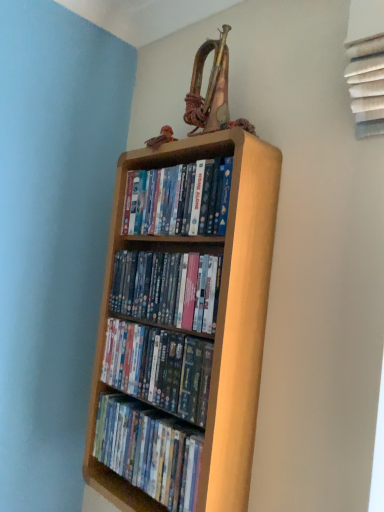
Question: Considering the relative sizes of light wood bookcase at center and matte plastic dvds at center, positioned as the third book in top-to-bottom order, in the image provided, is light wood bookcase at center thinner than matte plastic dvds at center, positioned as the third book in top-to-bottom order,?

Choices:
 (A) yes
 (B) no

Answer: (A)

Question: From a real-world perspective, is light wood bookcase at center on matte plastic dvds at center, positioned as the third book in top-to-bottom order?

Choices:
 (A) yes
 (B) no

Answer: (A)

Question: Can you confirm if light wood bookcase at center is wider than matte plastic dvds at center, acting as the second book starting from the bottom?

Choices:
 (A) yes
 (B) no

Answer: (B)

Question: Can you confirm if light wood bookcase at center is positioned to the right of matte plastic dvds at center, positioned as the third book in top-to-bottom order?

Choices:
 (A) yes
 (B) no

Answer: (A)

Question: Is light wood bookcase at center oriented towards matte plastic dvds at center, acting as the second book starting from the bottom?

Choices:
 (A) yes
 (B) no

Answer: (A)

Question: Is wooden shelf at center, the 3th book positioned from the bottom, taller or shorter than wooden shelf at center, the 4th book in the top-to-bottom sequence?

Choices:
 (A) short
 (B) tall

Answer: (A)

Question: Considering the positions of point (170, 257) and point (195, 501), is point (170, 257) closer or farther from the camera than point (195, 501)?

Choices:
 (A) closer
 (B) farther

Answer: (B)

Question: Considering the positions of wooden shelf at center, the 3th book positioned from the bottom, and wooden shelf at center, the 4th book in the top-to-bottom sequence, in the image, is wooden shelf at center, the 3th book positioned from the bottom, bigger or smaller than wooden shelf at center, the 4th book in the top-to-bottom sequence,?

Choices:
 (A) big
 (B) small

Answer: (B)

Question: Is wooden shelf at center, the 3th book positioned from the bottom, wider or thinner than wooden shelf at center, the 4th book in the top-to-bottom sequence?

Choices:
 (A) wide
 (B) thin

Answer: (B)

Question: From the image's perspective, is matte wooden shelf at upper center, the first book viewed from the top, above or below light wood bookcase at center?

Choices:
 (A) below
 (B) above

Answer: (B)

Question: In terms of height, does matte wooden shelf at upper center, acting as the fourth book starting from the bottom, look taller or shorter compared to light wood bookcase at center?

Choices:
 (A) short
 (B) tall

Answer: (A)

Question: Based on their sizes in the image, would you say matte wooden shelf at upper center, acting as the fourth book starting from the bottom, is bigger or smaller than light wood bookcase at center?

Choices:
 (A) big
 (B) small

Answer: (B)

Question: Considering the positions of point (157, 183) and point (238, 187), is point (157, 183) closer or farther from the camera than point (238, 187)?

Choices:
 (A) farther
 (B) closer

Answer: (A)

Question: Is matte plastic dvds at center, acting as the second book starting from the bottom, taller or shorter than wooden shelf at center, the 4th book in the top-to-bottom sequence?

Choices:
 (A) tall
 (B) short

Answer: (B)

Question: Does point (109, 321) appear closer or farther from the camera than point (173, 463)?

Choices:
 (A) farther
 (B) closer

Answer: (A)